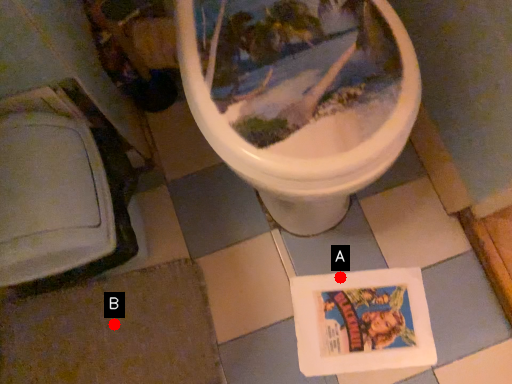
Question: Two points are circled on the image, labeled by A and B beside each circle. Which point appears closest to the camera in this image?

Choices:
 (A) A is closer
 (B) B is closer

Answer: (B)